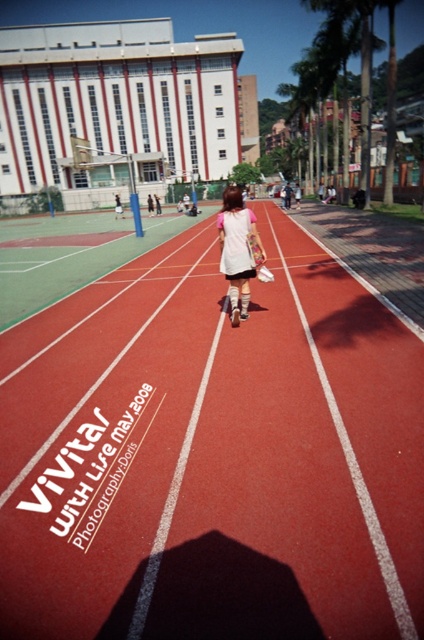
You are a track athlete preparing for a race and need to know the elevation difference between the rubber running track at center and the white rubber finish line at center. Can you determine which one is higher?

The rubber running track at center is taller than the white rubber finish line at center, so the track is higher.

Based on the photo, you are standing at the starting point of the race and see the rubber running track at center and the white rubber finish line at center. Which object is nearer to you?

The rubber running track at center is closer to you than the white rubber finish line at center.

You are standing at the edge of the rubber running track at center and want to pick up the white plastic tennis racket at center. Which direction should you move to reach it?

Since the rubber running track at center is closer to the viewer than the white plastic tennis racket at center, you should move forward away from the track towards the racket to reach it.